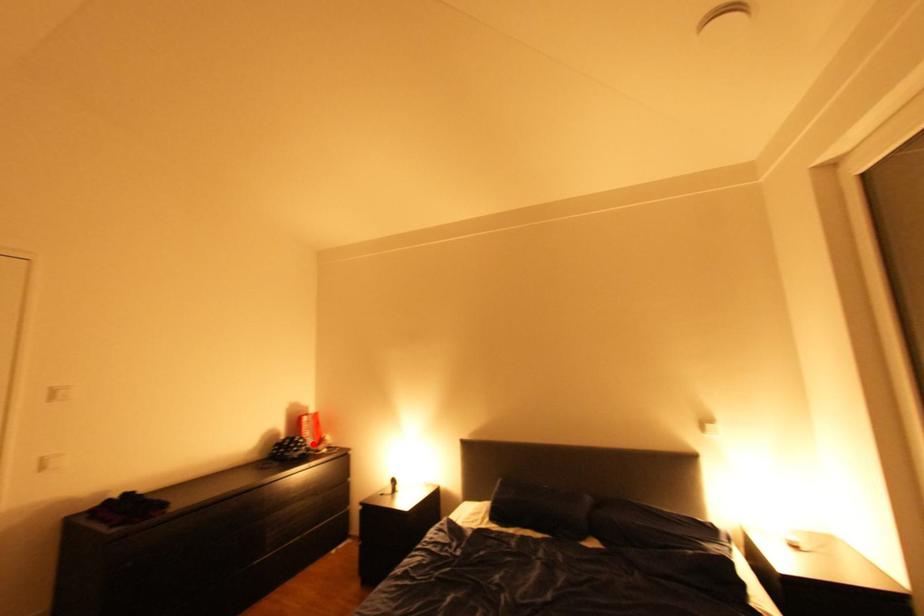
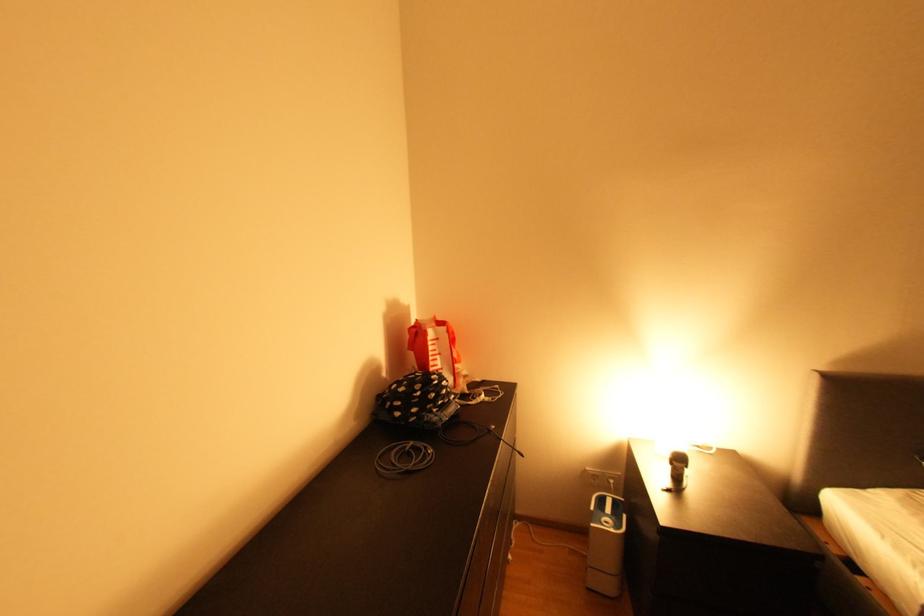
The point at the highlighted location is marked in the first image. Where is the corresponding point in the second image?

(457, 389)